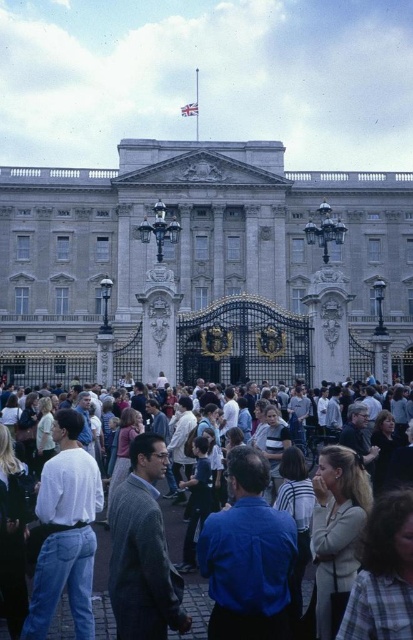
Can you confirm if white stone building at center is wider than gray wool suit at center?

Yes.

Is white stone building at center positioned in front of gray wool suit at center?

No, white stone building at center is behind gray wool suit at center.

Describe the element at coordinates (197, 259) in the screenshot. The image size is (413, 640). I see `white stone building at center` at that location.

The height and width of the screenshot is (640, 413). Identify the location of white stone building at center. (197, 259).

Which is in front, point (351, 628) or point (324, 460)?

Point (351, 628) is in front.

Does plaid shirt at lower right appear under light beige jacket at center?

Actually, plaid shirt at lower right is above light beige jacket at center.

The image size is (413, 640). What do you see at coordinates (384, 573) in the screenshot? I see `plaid shirt at lower right` at bounding box center [384, 573].

Identify the location of plaid shirt at lower right. (384, 573).

Can you confirm if gray wool suit at center is bigger than light beige jacket at center?

Indeed, gray wool suit at center has a larger size compared to light beige jacket at center.

Who is more forward, [159,538] or [322,522]?

Positioned in front is point [159,538].

Describe the element at coordinates (142, 550) in the screenshot. I see `gray wool suit at center` at that location.

The height and width of the screenshot is (640, 413). I want to click on gray wool suit at center, so click(x=142, y=550).